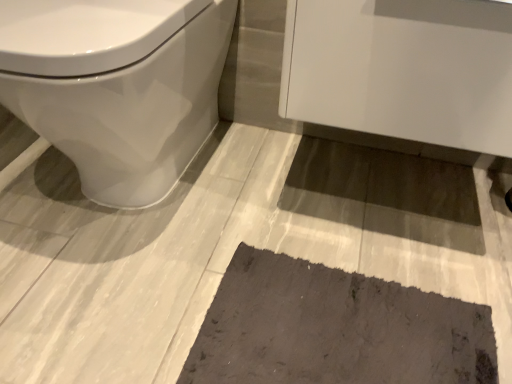
Question: Is white glossy toilet at left to the left or to the right of dark gray textured bath mat at lower center in the image?

Choices:
 (A) left
 (B) right

Answer: (A)

Question: From a real-world perspective, relative to dark gray textured bath mat at lower center, is white glossy toilet at left vertically above or below?

Choices:
 (A) above
 (B) below

Answer: (A)

Question: Estimate the real-world distances between objects in this image. Which object is closer to the dark gray textured bath mat at lower center?

Choices:
 (A) white glossy cabinet at upper right
 (B) white glossy toilet at left

Answer: (A)

Question: Which is nearer to the dark gray textured bath mat at lower center?

Choices:
 (A) white glossy cabinet at upper right
 (B) white glossy toilet at left

Answer: (A)